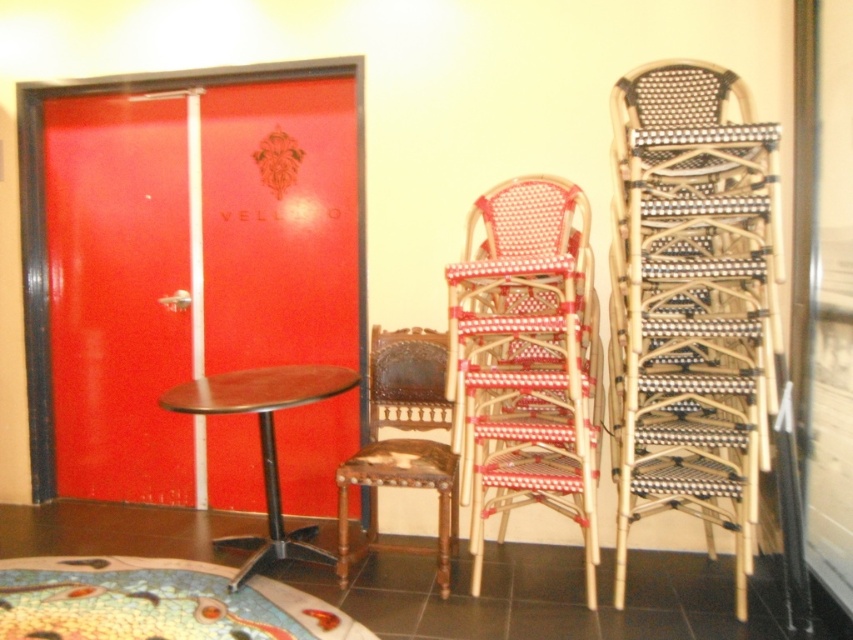
How much distance is there between shiny red door at left and dark brown wood table at center?

shiny red door at left is 23.89 inches away from dark brown wood table at center.

What do you see at coordinates (117, 296) in the screenshot?
I see `shiny red door at left` at bounding box center [117, 296].

You are a GUI agent. You are given a task and a screenshot of the screen. Output one action in this format:
    pyautogui.click(x=<x>, y=<y>)
    Task: Click on the shiny red door at left
    
    Given the screenshot: What is the action you would take?
    pyautogui.click(x=117, y=296)

From the picture: Is woven rattan chairs at right above brown wood chair at center?

Yes, woven rattan chairs at right is above brown wood chair at center.

Between point (730, 417) and point (337, 557), which one is positioned in front?

Point (730, 417)

Where is `woven rattan chairs at right`? This screenshot has height=640, width=853. woven rattan chairs at right is located at coordinates (692, 304).

What do you see at coordinates (521, 394) in the screenshot? Image resolution: width=853 pixels, height=640 pixels. I see `woven rattan chair at center` at bounding box center [521, 394].

Which is behind, point (514, 268) or point (456, 522)?

The point (456, 522) is behind.

Find the location of a particular element. The width and height of the screenshot is (853, 640). woven rattan chair at center is located at coordinates (521, 394).